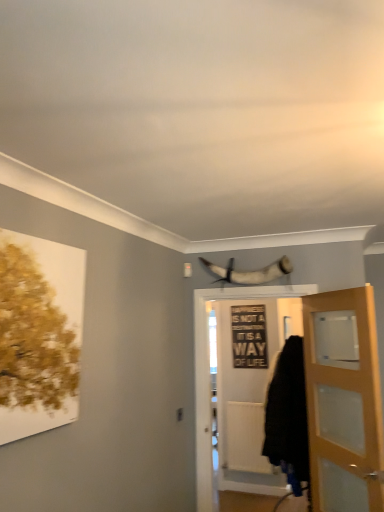
Question: From the image's perspective, is light brown wooden door at right, which ranks as the 2th door in left-to-right order, above black matte sign at center?

Choices:
 (A) no
 (B) yes

Answer: (A)

Question: Is black matte sign at center at the back of light brown wooden door at right, the 1th door from the right?

Choices:
 (A) yes
 (B) no

Answer: (B)

Question: From a real-world perspective, is light brown wooden door at right, which ranks as the 2th door in left-to-right order, positioned under black matte sign at center based on gravity?

Choices:
 (A) no
 (B) yes

Answer: (B)

Question: Is light brown wooden door at right, which ranks as the 2th door in left-to-right order, at the right side of black matte sign at center?

Choices:
 (A) no
 (B) yes

Answer: (B)

Question: Is light brown wooden door at right, the 1th door from the right, wider than black matte sign at center?

Choices:
 (A) yes
 (B) no

Answer: (A)

Question: From a real-world perspective, is light brown wooden door at right, which ranks as the 2th door in left-to-right order, physically above black matte sign at center?

Choices:
 (A) no
 (B) yes

Answer: (A)

Question: From a real-world perspective, is shiny silver horn at upper center under black fabric cloak at lower right?

Choices:
 (A) yes
 (B) no

Answer: (B)

Question: Can we say shiny silver horn at upper center lies outside black fabric cloak at lower right?

Choices:
 (A) yes
 (B) no

Answer: (A)

Question: Is shiny silver horn at upper center facing towards black fabric cloak at lower right?

Choices:
 (A) no
 (B) yes

Answer: (A)

Question: Does shiny silver horn at upper center have a lesser height compared to black fabric cloak at lower right?

Choices:
 (A) yes
 (B) no

Answer: (A)

Question: Is shiny silver horn at upper center bigger than black fabric cloak at lower right?

Choices:
 (A) no
 (B) yes

Answer: (A)

Question: Is shiny silver horn at upper center thinner than black fabric cloak at lower right?

Choices:
 (A) no
 (B) yes

Answer: (B)

Question: Considering the relative sizes of shiny silver horn at upper center and light brown wooden door at right, which ranks as the 2th door in left-to-right order, in the image provided, is shiny silver horn at upper center shorter than light brown wooden door at right, which ranks as the 2th door in left-to-right order,?

Choices:
 (A) yes
 (B) no

Answer: (A)